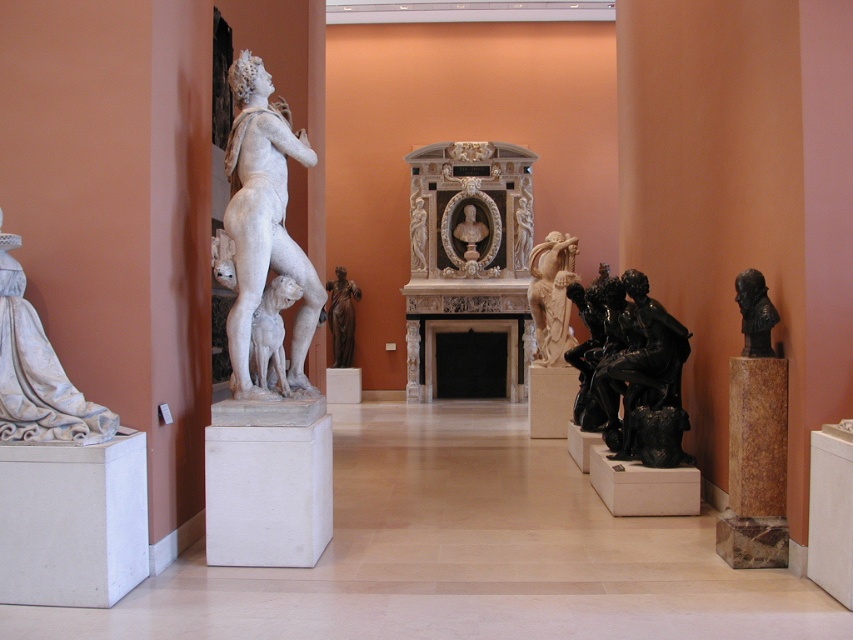
Who is positioned more to the right, white marble statue at left or matte white draped cloth at left?

Positioned to the right is white marble statue at left.

Does point (302, 275) come behind point (30, 408)?

Yes, point (302, 275) is farther from viewer.

Identify the location of white marble statue at left. The image size is (853, 640). (264, 224).

Is white marble statue at left smaller than light beige marble statue at center?

Actually, white marble statue at left might be larger than light beige marble statue at center.

Can you confirm if white marble statue at left is positioned to the right of light beige marble statue at center?

Incorrect, white marble statue at left is not on the right side of light beige marble statue at center.

The height and width of the screenshot is (640, 853). Identify the location of white marble statue at left. (264, 224).

Is black polished marble group at center to the right of light beige marble statue at center from the viewer's perspective?

Yes, black polished marble group at center is to the right of light beige marble statue at center.

How far apart are black polished marble group at center and light beige marble statue at center?

They are 7.82 feet apart.

This screenshot has height=640, width=853. Identify the location of black polished marble group at center. (630, 371).